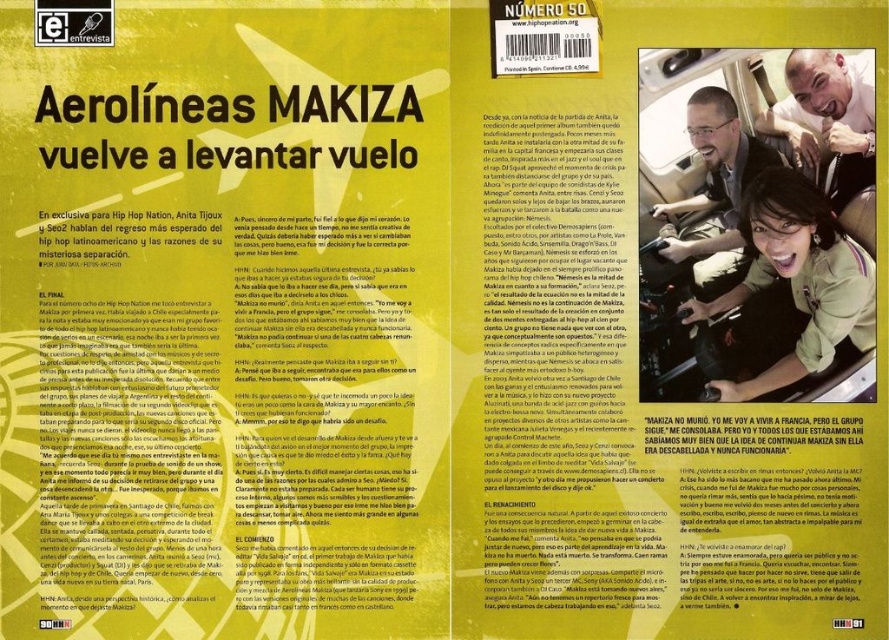
Who is positioned more to the right, matte black man at upper right or blackpapertext at center?

blackpapertext at center

Is point (727, 266) positioned in front of point (677, 440)?

Yes, it is in front of point (677, 440).

In order to click on matte black man at upper right in this screenshot , I will do `click(717, 188)`.

Who is more forward, (865,168) or (749,419)?

Point (865,168) is in front.

Is point (854, 156) farther from viewer compared to point (778, 449)?

No.

Where is `matte black face at upper right`? The height and width of the screenshot is (640, 889). matte black face at upper right is located at coordinates (829, 120).

Is matte black hair at upper right behind matte black man at upper right?

No, it is not.

From the picture: Which is below, matte black hair at upper right or matte black man at upper right?

matte black hair at upper right

Does point (738, 394) lie in front of point (731, 230)?

Yes, point (738, 394) is in front of point (731, 230).

Where is `matte black hair at upper right`? This screenshot has height=640, width=889. matte black hair at upper right is located at coordinates (798, 280).